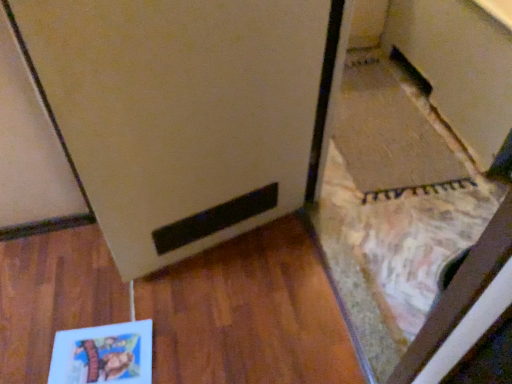
The height and width of the screenshot is (384, 512). I want to click on free location to the left of matte paper book at lower left, so click(35, 325).